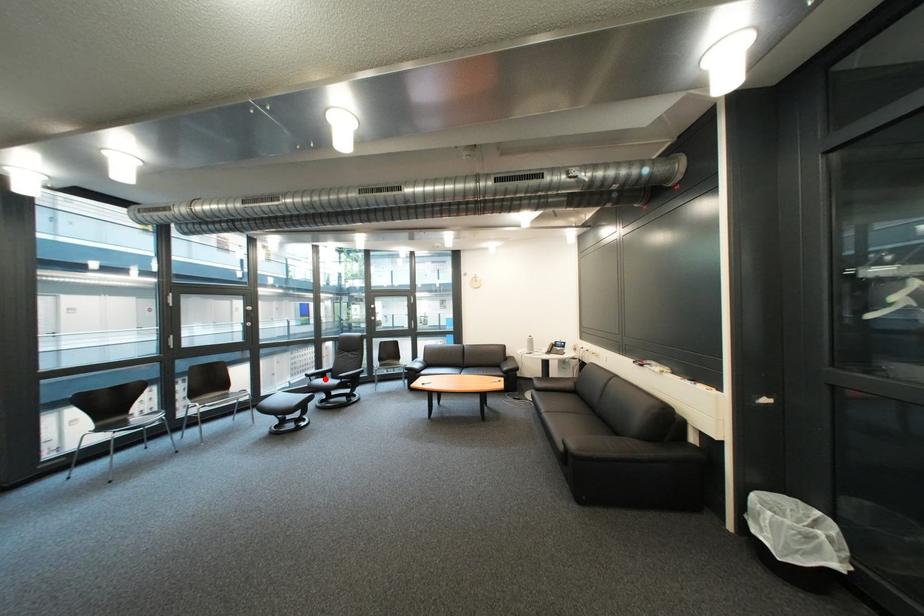
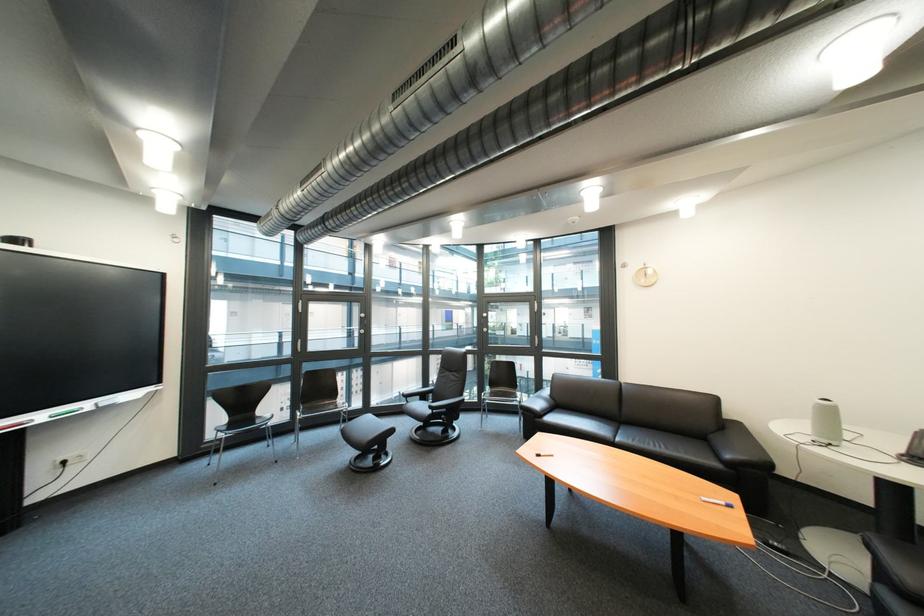
Question: I am providing you with two images of the same scene from different viewpoints. In image1, a red point is highlighted. Considering the same 3D point in image2, which of the following is correct?

Choices:
 (A) It is closer
 (B) It is farther

Answer: (A)